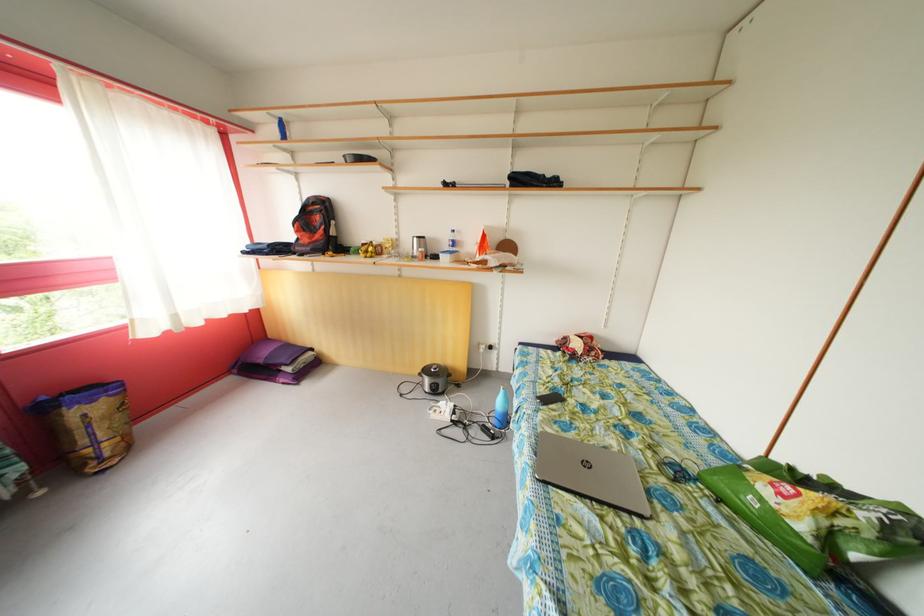
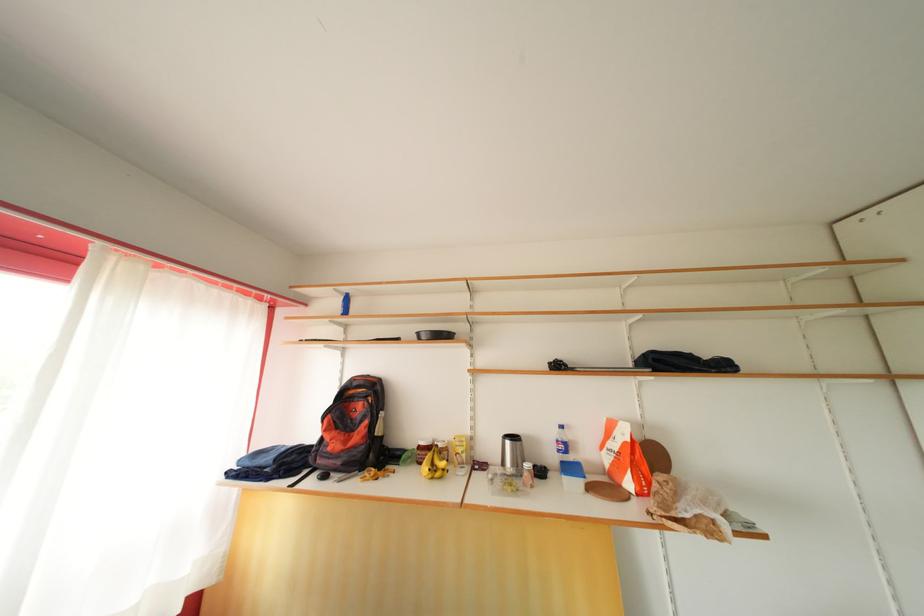
Locate, in the second image, the point that corresponds to (x=422, y=245) in the first image.

(515, 448)